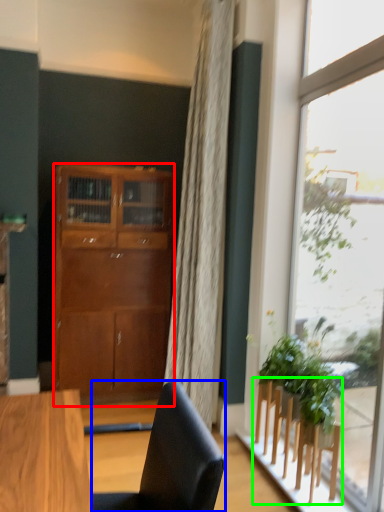
Question: Which is farther away from cabinetry (highlighted by a red box)? chair (highlighted by a blue box) or furniture (highlighted by a green box)?

Choices:
 (A) chair
 (B) furniture

Answer: (A)